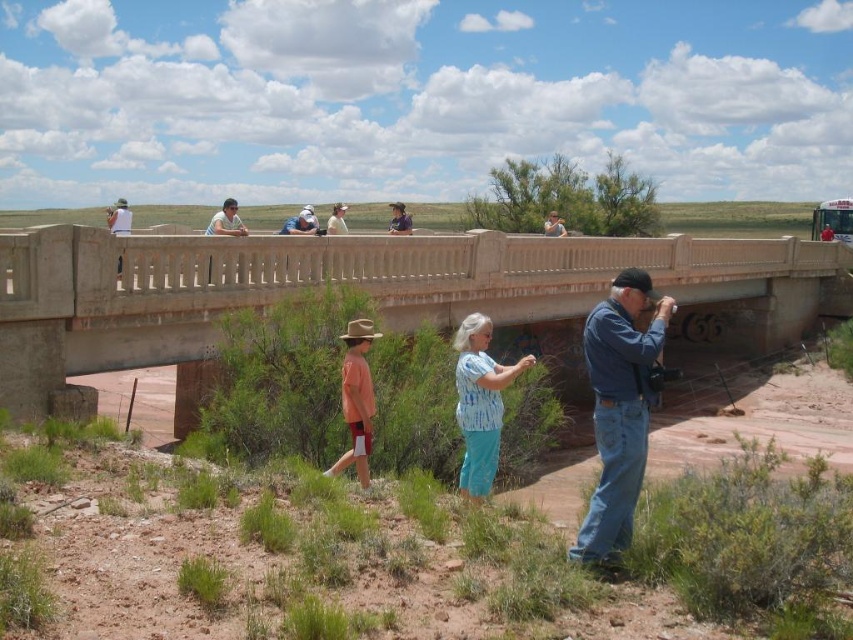
Question: Which point is closer to the camera taking this photo?

Choices:
 (A) (675, 296)
 (B) (466, 326)
 (C) (628, 474)

Answer: (C)

Question: Which point is farther to the camera?

Choices:
 (A) blue tie-dye shirt at center
 (B) blue denim jeans at lower right
 (C) concrete bridge at center

Answer: (C)

Question: Which point is farther to the camera?

Choices:
 (A) (497, 438)
 (B) (363, 456)
 (C) (611, 563)
 (D) (791, 323)

Answer: (D)

Question: Does blue denim jeans at lower right have a smaller size compared to blue tie-dye shirt at center?

Choices:
 (A) yes
 (B) no

Answer: (B)

Question: Can you confirm if concrete bridge at center is wider than blue denim jeans at lower right?

Choices:
 (A) yes
 (B) no

Answer: (A)

Question: From the image, what is the correct spatial relationship of concrete bridge at center in relation to blue tie-dye shirt at center?

Choices:
 (A) right
 (B) left

Answer: (A)